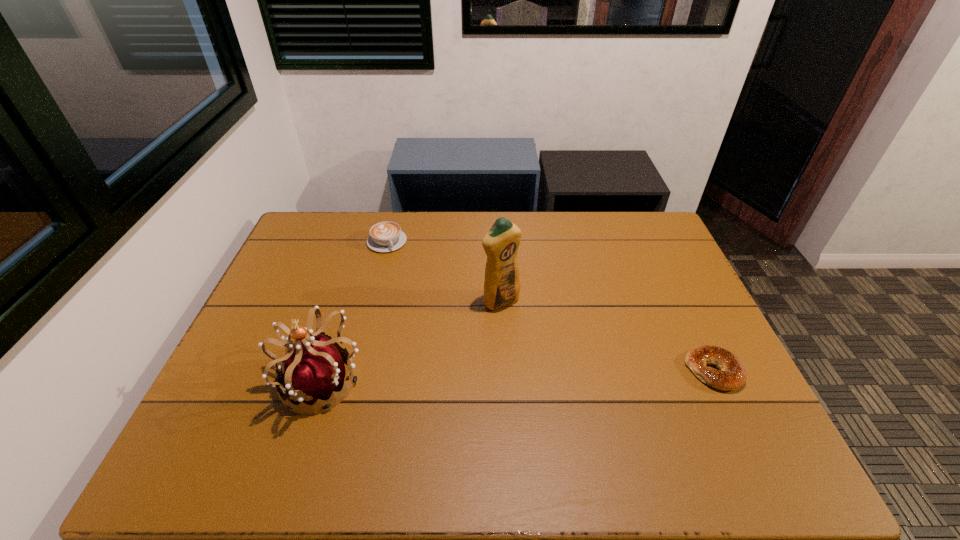
This screenshot has height=540, width=960. Identify the location of vacant space on the desktop that is between the tiara and the shortest object and is positioned on the label of the detergent. (577, 374).

Locate an element on the screen. This screenshot has height=540, width=960. free spot on the desktop that is between the tiara and the shortest object and is positioned on the side of the third tallest object with the handle is located at coordinates (463, 377).